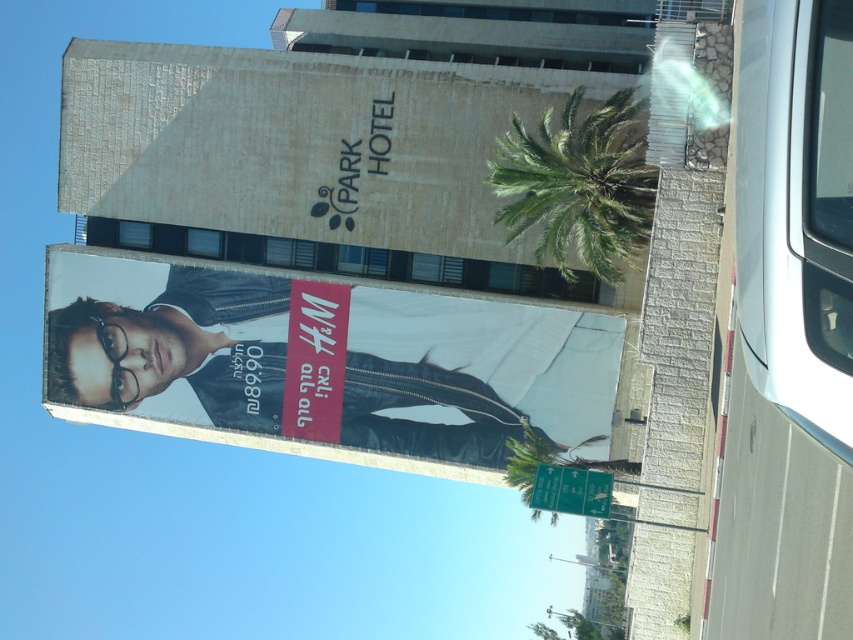
Can you confirm if matte stone billboard at center is bigger than green leafy palm tree at upper right?

Correct, matte stone billboard at center is larger in size than green leafy palm tree at upper right.

Who is more distant from viewer, (259, 241) or (515, 144)?

The point (259, 241) is behind.

At what (x,y) coordinates should I click in order to perform the action: click on matte stone billboard at center. Please return your answer as a coordinate pair (x, y). Looking at the image, I should click on (299, 157).

Between matte black jacket at center and matte stone billboard at center, which one appears on the right side from the viewer's perspective?

From the viewer's perspective, matte stone billboard at center appears more on the right side.

Can you confirm if matte black jacket at center is positioned to the right of matte stone billboard at center?

Incorrect, matte black jacket at center is not on the right side of matte stone billboard at center.

Who is more forward, [352,305] or [502,83]?

Point [502,83] is in front.

I want to click on matte black jacket at center, so click(x=322, y=364).

Who is higher up, matte black jacket at center or green leafy palm tree at upper right?

green leafy palm tree at upper right is above.

From the picture: Does matte black jacket at center appear on the left side of green leafy palm tree at upper right?

Correct, you'll find matte black jacket at center to the left of green leafy palm tree at upper right.

Who is more forward, (425, 356) or (497, 140)?

Point (497, 140)

You are a GUI agent. You are given a task and a screenshot of the screen. Output one action in this format:
    pyautogui.click(x=<x>, y=<y>)
    Task: Click on the matte black jacket at center
    This screenshot has width=853, height=640.
    Given the screenshot: What is the action you would take?
    pyautogui.click(x=322, y=364)